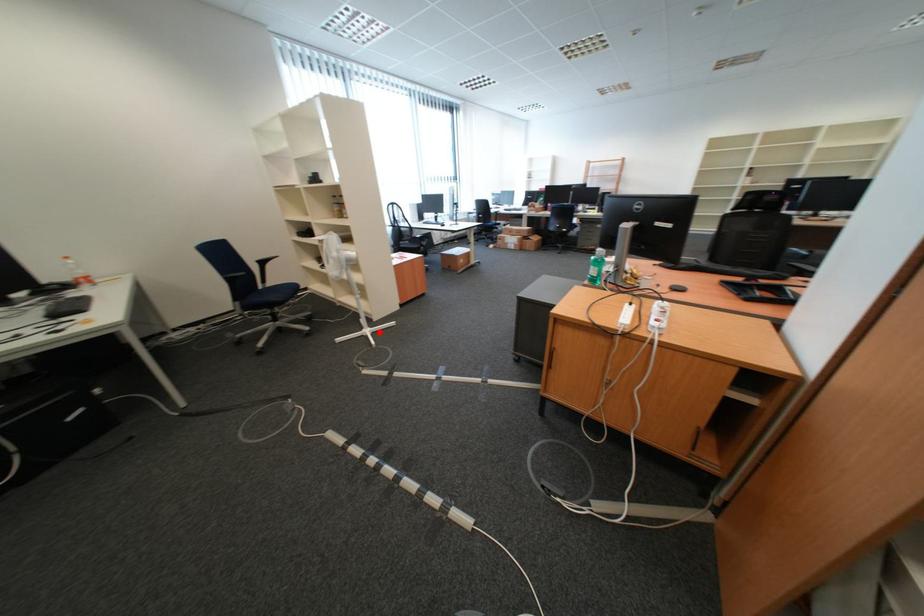
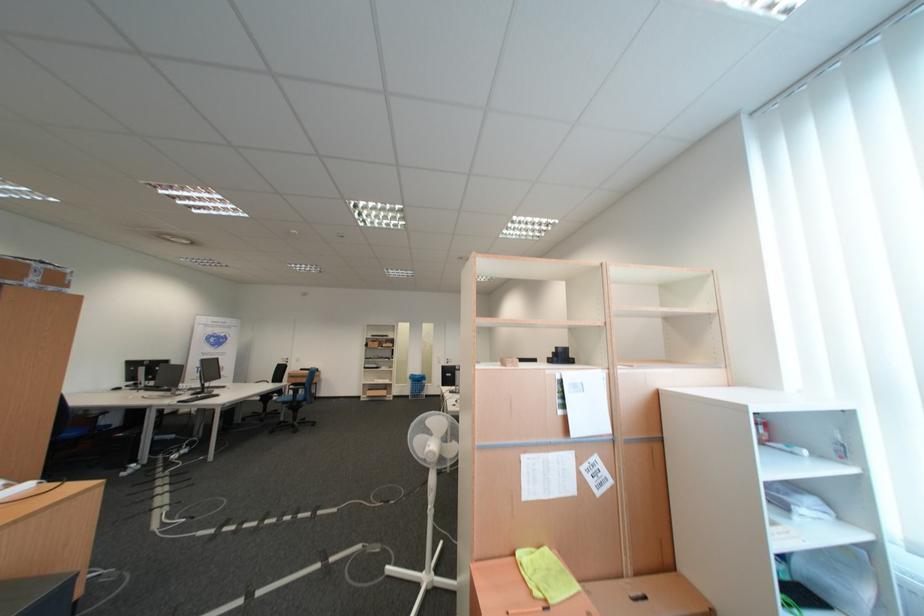
Find the pixel in the second image that matches the highlighted location in the first image.

(439, 578)